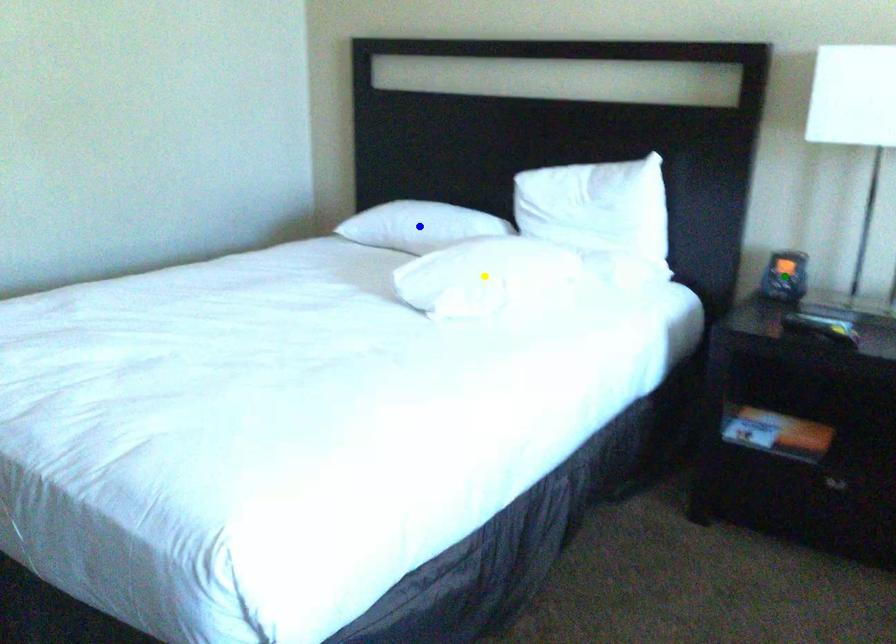
Order these from nearest to farthest:
yellow point | blue point | green point

yellow point → green point → blue point